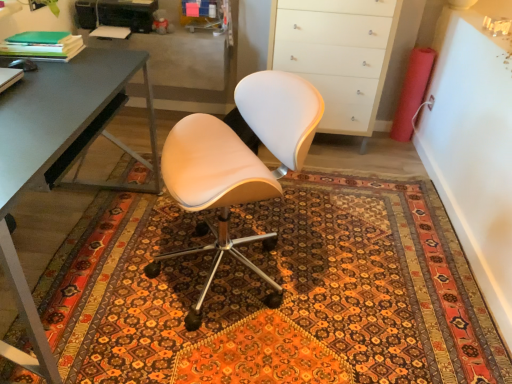
What do you see at coordinates (239, 164) in the screenshot?
I see `matte white chair at center` at bounding box center [239, 164].

Identify the location of white glossy cabinet at upper right. Image resolution: width=512 pixels, height=384 pixels. (402, 56).

Which object is further away from the camera taking this photo, green matte folder at upper left or matte white chair at center?

green matte folder at upper left is behind.

Are green matte folder at upper left and matte white chair at center far apart?

That's not correct — green matte folder at upper left is a little close to matte white chair at center.

Can you confirm if green matte folder at upper left is wider than matte white chair at center?

No, green matte folder at upper left is not wider than matte white chair at center.

Which is more to the left, green matte folder at upper left or matte white chair at center?

green matte folder at upper left.

Is white glossy cabinet at upper right completely or partially outside of matte white chair at center?

Indeed, white glossy cabinet at upper right is completely outside matte white chair at center.

Measure the distance from white glossy cabinet at upper right to matte white chair at center.

white glossy cabinet at upper right and matte white chair at center are 1.65 meters apart.

Considering the positions of objects white glossy cabinet at upper right and matte white chair at center in the image provided, who is more to the left, white glossy cabinet at upper right or matte white chair at center?

matte white chair at center.

Between white glossy cabinet at upper right and matte white chair at center, which one has larger size?

With larger size is matte white chair at center.

Is white glossy cabinet at upper right in front of or behind green matte folder at upper left in the image?

In the image, white glossy cabinet at upper right appears behind green matte folder at upper left.

From the image's perspective, which object appears higher, white glossy cabinet at upper right or green matte folder at upper left?

white glossy cabinet at upper right.

This screenshot has height=384, width=512. Identify the location of cabinetry that appears above the green matte folder at upper left (from the image's perspective). (402, 56).

Is white glossy cabinet at upper right smaller than green matte folder at upper left?

Actually, white glossy cabinet at upper right might be larger than green matte folder at upper left.

From the image's perspective, which one is positioned higher, patterned carpet at center or matte white chair at center?

matte white chair at center.

Considering the positions of points (279, 244) and (262, 81), is point (279, 244) farther from camera compared to point (262, 81)?

That is True.

Is patterned carpet at center positioned in front of matte white chair at center?

No, patterned carpet at center is behind matte white chair at center.

Could you tell me if patterned carpet at center is turned towards matte white chair at center?

No, patterned carpet at center is not oriented towards matte white chair at center.

Is patterned carpet at center not near green matte folder at upper left?

That's right, there is a large distance between patterned carpet at center and green matte folder at upper left.

Looking at this image, which is more to the left, patterned carpet at center or green matte folder at upper left?

green matte folder at upper left is more to the left.

Is point (386, 365) behind point (56, 49)?

No, it is in front of (56, 49).

Is patterned carpet at center aimed at white glossy cabinet at upper right?

No, patterned carpet at center does not turn towards white glossy cabinet at upper right.

Based on their sizes in the image, would you say patterned carpet at center is bigger or smaller than white glossy cabinet at upper right?

In the image, patterned carpet at center appears to be smaller than white glossy cabinet at upper right.

Between patterned carpet at center and white glossy cabinet at upper right, which one has larger width?

patterned carpet at center is wider.

Which object is positioned more to the right, patterned carpet at center or white glossy cabinet at upper right?

white glossy cabinet at upper right.

Considering the positions of objects green matte folder at upper left and patterned carpet at center in the image provided, who is in front, green matte folder at upper left or patterned carpet at center?

patterned carpet at center is closer to the camera.

From a real-world perspective, is green matte folder at upper left beneath patterned carpet at center?

Actually, green matte folder at upper left is physically above patterned carpet at center in the real world.

Looking at this image, would you say green matte folder at upper left is a long distance from patterned carpet at center?

That's right, there is a large distance between green matte folder at upper left and patterned carpet at center.

Is green matte folder at upper left looking in the opposite direction of patterned carpet at center?

green matte folder at upper left does not have its back to patterned carpet at center.

Locate an element on the screen. book above the matte white chair at center (from a real-world perspective) is located at coordinates (42, 45).

At what (x,y) coordinates should I click in order to perform the action: click on cabinetry above the matte white chair at center (from the image's perspective). Please return your answer as a coordinate pair (x, y). The image size is (512, 384). Looking at the image, I should click on (402, 56).

When comparing their distances from white glossy cabinet at upper right, does green matte folder at upper left or patterned carpet at center seem further?

The object further to white glossy cabinet at upper right is green matte folder at upper left.

Based on the photo, based on their spatial positions, is patterned carpet at center or white glossy cabinet at upper right closer to matte white chair at center?

Based on the image, patterned carpet at center appears to be nearer to matte white chair at center.

Looking at the image, which one is located closer to patterned carpet at center, matte white chair at center or metallic gray desk at left?

matte white chair at center is closer to patterned carpet at center.

Looking at this image, when comparing their distances from green matte folder at upper left, does matte white chair at center or patterned carpet at center seem further?

patterned carpet at center lies further to green matte folder at upper left than the other object.

Looking at the image, which one is located further to white glossy cabinet at upper right, matte white chair at center or metallic gray desk at left?

The object further to white glossy cabinet at upper right is metallic gray desk at left.

Looking at the image, which one is located further to matte white chair at center, patterned carpet at center or metallic gray desk at left?

Among the two, patterned carpet at center is located further to matte white chair at center.

Based on their spatial positions, is green matte folder at upper left or patterned carpet at center further from matte white chair at center?

Among the two, green matte folder at upper left is located further to matte white chair at center.

From the image, which object appears to be nearer to green matte folder at upper left, matte white chair at center or white glossy cabinet at upper right?

Based on the image, matte white chair at center appears to be nearer to green matte folder at upper left.

Locate an element on the screen. The height and width of the screenshot is (384, 512). chair between green matte folder at upper left and white glossy cabinet at upper right is located at coordinates (239, 164).

Image resolution: width=512 pixels, height=384 pixels. I want to click on chair between metallic gray desk at left and patterned carpet at center in the horizontal direction, so click(239, 164).

The height and width of the screenshot is (384, 512). I want to click on doormat between green matte folder at upper left and white glossy cabinet at upper right, so click(266, 291).

I want to click on desk situated between green matte folder at upper left and patterned carpet at center from left to right, so click(x=59, y=156).